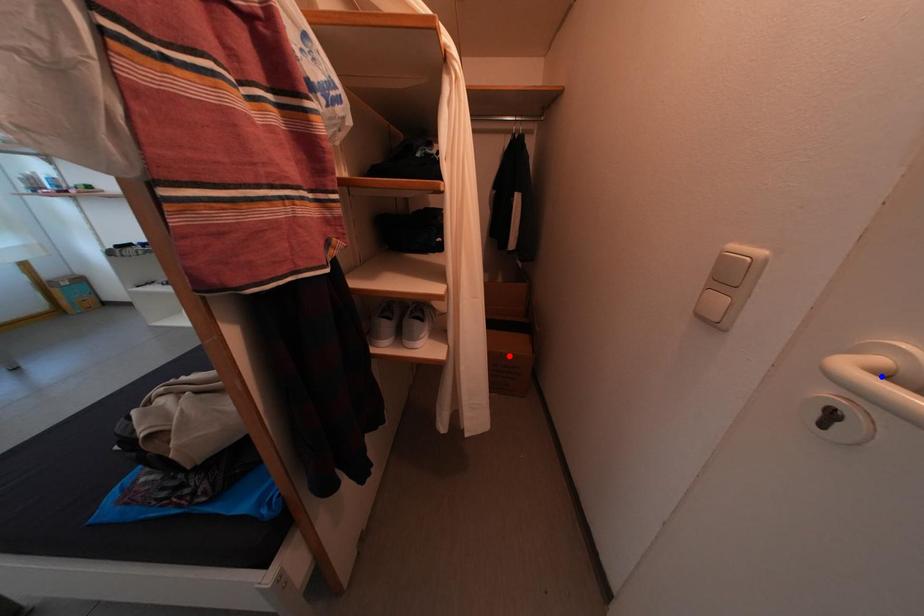
Question: Which of the two points in the image is closer to the camera?

Choices:
 (A) Blue point is closer.
 (B) Red point is closer.

Answer: (A)